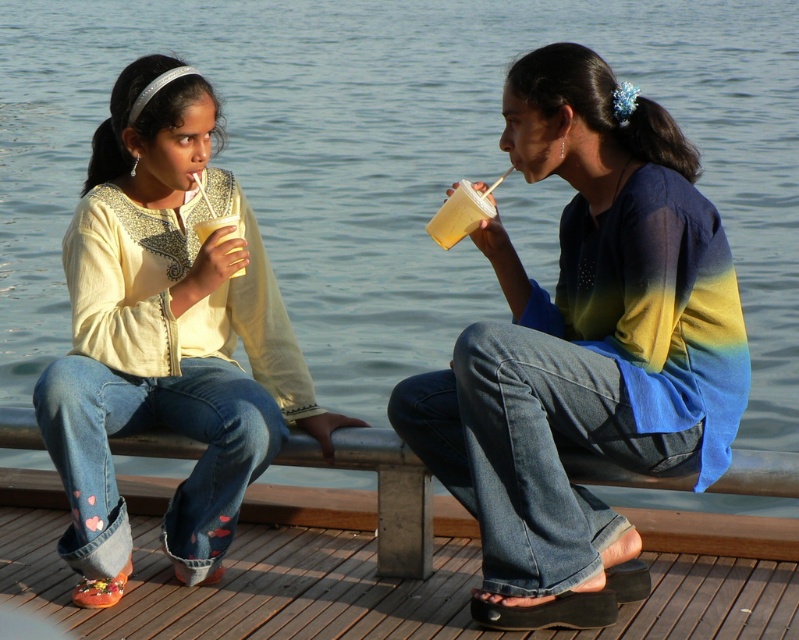
You are a photographer trying to capture a closeup of the translucent plastic cup at left without including the matte yellow shirt at left in the frame. Is this possible given their positions?

The matte yellow shirt at left is positioned on the left side of the translucent plastic cup at left, so the shirt is adjacent to the cup. To avoid including the shirt, the photographer would need to angle the camera to focus solely on the cup while excluding the shirt, but since the shirt is directly to the left of the cup, this might be challenging depending on the camera angle and lens focal length. However, based on their spatial arrangement, it is technically possible if the photographer adjusts the v

You are standing on the dock and want to place a small item exactly at the point marked by coordinates (585, 349). Which object from the scene will this point land on?

The point at coordinates (585, 349) is on the ombre fabric shirt at center, so placing the item there would land it on the ombre fabric shirt at center.